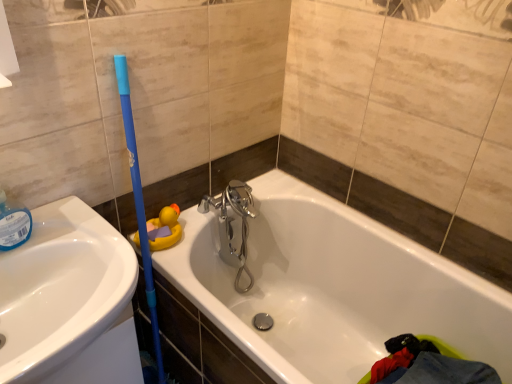
Question: Considering their positions, is white glossy bathtub at center located in front of or behind white glossy sink at left?

Choices:
 (A) front
 (B) behind

Answer: (A)

Question: Based on their sizes in the image, would you say white glossy bathtub at center is bigger or smaller than white glossy sink at left?

Choices:
 (A) small
 (B) big

Answer: (B)

Question: Which of these objects is positioned farthest from the white glossy bathtub at center?

Choices:
 (A) yellow rubber duck at upper left
 (B) white glossy sink at left

Answer: (B)

Question: Based on their relative distances, which object is farther from the white glossy sink at left?

Choices:
 (A) yellow rubber duck at upper left
 (B) white glossy bathtub at center

Answer: (B)